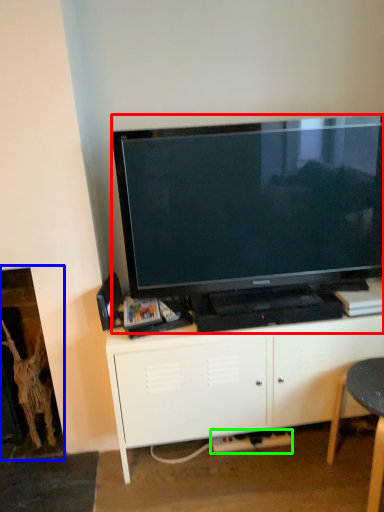
Question: Considering the real-world distances, which object is farthest from television (highlighted by a red box)? fireplace (highlighted by a blue box) or plug (highlighted by a green box)?

Choices:
 (A) fireplace
 (B) plug

Answer: (B)